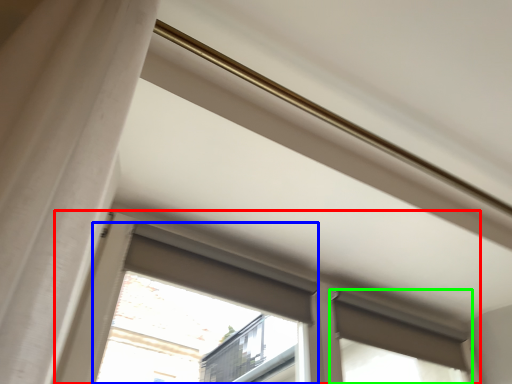
Question: Considering the real-world distances, which object is closest to window (highlighted by a red box)? bay window (highlighted by a blue box) or window (highlighted by a green box).

Choices:
 (A) bay window
 (B) window

Answer: (B)